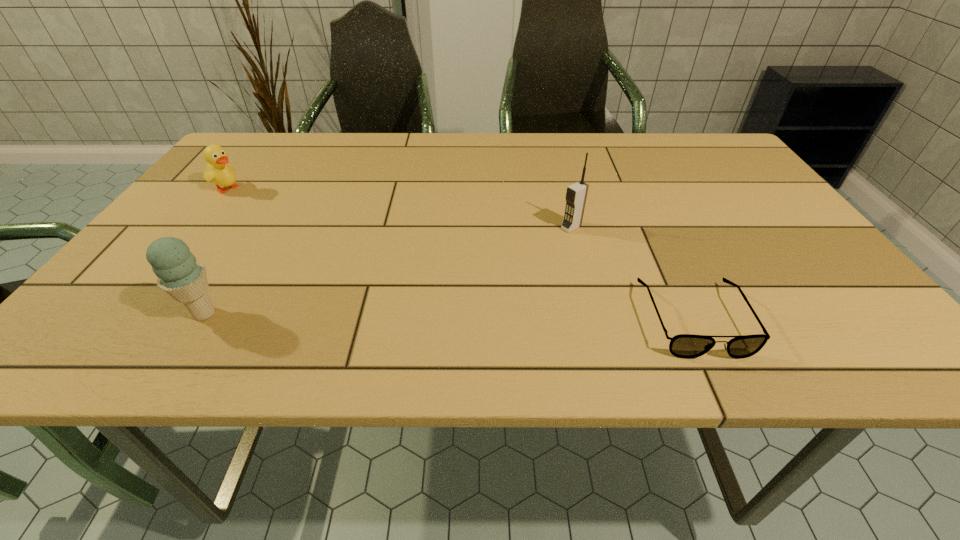
Identify the location of free space located 0.300m on the front-facing side of the second farthest object. (460, 290).

Find the location of a particular element. vacant space situated 0.340m on the front-facing side of the farthest object is located at coordinates (329, 241).

Find the location of a particular element. Image resolution: width=960 pixels, height=540 pixels. free space located on the front-facing side of the farthest object is located at coordinates (300, 225).

The image size is (960, 540). I want to click on vacant region located 0.050m on the front-facing side of the farthest object, so click(x=252, y=199).

I want to click on ice cream present at the near edge, so click(179, 274).

Where is `spectacles that is at the near edge`? spectacles that is at the near edge is located at coordinates (687, 346).

Find the location of a particular element. object that is positioned at the left edge is located at coordinates (218, 171).

Find the location of a particular element. Image resolution: width=960 pixels, height=540 pixels. vacant space at the far edge of the desktop is located at coordinates (527, 152).

Where is `free region at the near edge of the desktop`? Image resolution: width=960 pixels, height=540 pixels. free region at the near edge of the desktop is located at coordinates (363, 289).

The height and width of the screenshot is (540, 960). In the image, there is a desktop. Find the location of `vacant space at the left edge`. vacant space at the left edge is located at coordinates (195, 253).